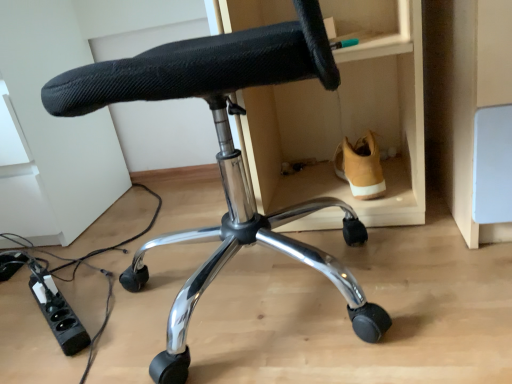
Question: Is black plastic power strip at lower left looking in the opposite direction of tan suede shoe at lower right?

Choices:
 (A) yes
 (B) no

Answer: (B)

Question: Is black plastic power strip at lower left positioned in front of tan suede shoe at lower right?

Choices:
 (A) yes
 (B) no

Answer: (A)

Question: Is black plastic power strip at lower left facing towards tan suede shoe at lower right?

Choices:
 (A) yes
 (B) no

Answer: (B)

Question: From the image's perspective, does black plastic power strip at lower left appear lower than tan suede shoe at lower right?

Choices:
 (A) yes
 (B) no

Answer: (A)

Question: Does black plastic power strip at lower left have a larger size compared to tan suede shoe at lower right?

Choices:
 (A) no
 (B) yes

Answer: (A)

Question: Would you say black mesh chair at center is to the left or to the right of black plastic power strip at lower left in the picture?

Choices:
 (A) left
 (B) right

Answer: (B)

Question: Is black mesh chair at center bigger or smaller than black plastic power strip at lower left?

Choices:
 (A) big
 (B) small

Answer: (A)

Question: Considering the positions of black mesh chair at center and black plastic power strip at lower left in the image, is black mesh chair at center taller or shorter than black plastic power strip at lower left?

Choices:
 (A) short
 (B) tall

Answer: (B)

Question: In terms of width, does black mesh chair at center look wider or thinner when compared to black plastic power strip at lower left?

Choices:
 (A) wide
 (B) thin

Answer: (A)

Question: From a real-world perspective, is black mesh chair at center physically located above or below tan suede shoe at lower right?

Choices:
 (A) above
 (B) below

Answer: (A)

Question: Looking at their shapes, would you say black mesh chair at center is wider or thinner than tan suede shoe at lower right?

Choices:
 (A) thin
 (B) wide

Answer: (B)

Question: From their relative heights in the image, would you say black mesh chair at center is taller or shorter than tan suede shoe at lower right?

Choices:
 (A) tall
 (B) short

Answer: (A)

Question: From the image's perspective, is black mesh chair at center located above or below tan suede shoe at lower right?

Choices:
 (A) below
 (B) above

Answer: (A)

Question: Visually, is tan suede shoe at lower right positioned to the left or to the right of black plastic power strip at lower left?

Choices:
 (A) left
 (B) right

Answer: (B)

Question: Is point (354, 192) closer or farther from the camera than point (73, 334)?

Choices:
 (A) farther
 (B) closer

Answer: (A)